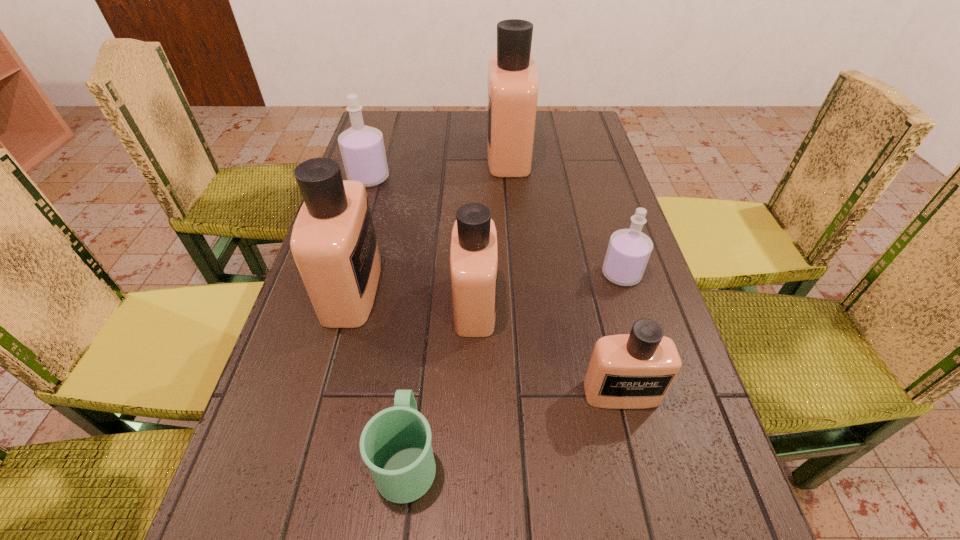
Locate an element on the screen. beige perfume that stands as the closest to the second biggest beige perfume is located at coordinates (474, 251).

Identify the location of vacant space that satisfies the following two spatial constraints: 1. on the front label of the leftmost beige perfume; 2. on the side of the shortest object with the handle. (306, 457).

At what (x,y) coordinates should I click in order to perform the action: click on vacant space that satisfies the following two spatial constraints: 1. on the side of the right purple perfume with the handle; 2. on the left side of the fifth object from right to left. Please return your answer as a coordinate pair (x, y). The height and width of the screenshot is (540, 960). Looking at the image, I should click on (428, 274).